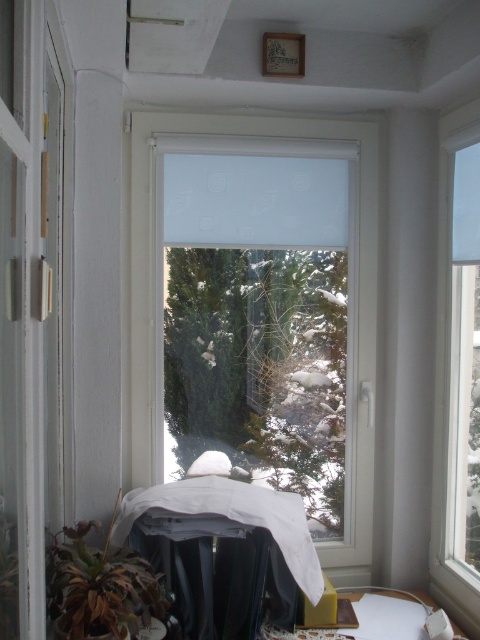
You are a window cleaner who needs to clean both the transparent glass window at right and the green matte plant at lower left. Which object requires you to reach higher due to its height?

The transparent glass window at right requires reaching higher because it has a greater height compared to the green matte plant at lower left.

Consider the image. You are an interior designer planning to install a new decorative sticker on the window. The sticker requires a window with a larger surface area. Which window should you choose between the transparent plastic window at center and the transparent glass window at right?

The transparent plastic window at center has a larger size compared to the transparent glass window at right, so you should choose the transparent plastic window at center for the sticker requiring a larger surface area.

You are an interior designer planning to install a new curtain rod between the transparent plastic window at center and the transparent glass window at right. The rod requires a minimum of 1 meter of space between the two windows. Can the rod be installed based on their widths?

The transparent plastic window at center is wider than the transparent glass window at right. However, the question asks about the distance between the windows, not their widths. Since the scene description mentions the windows are large but doesn not provide exact spacing, we cannot determine if the 1 meter requirement is met. More information is needed.